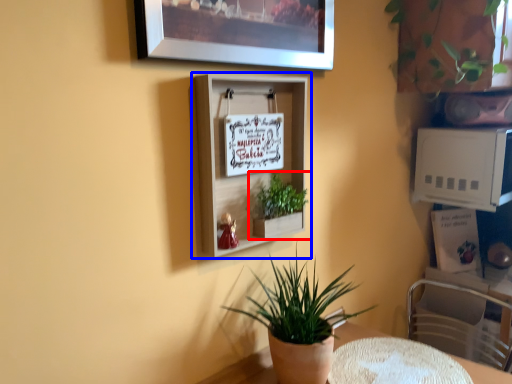
Question: Which object appears closest to the camera in this image, houseplant (highlighted by a red box) or shelf (highlighted by a blue box)?

Choices:
 (A) houseplant
 (B) shelf

Answer: (B)